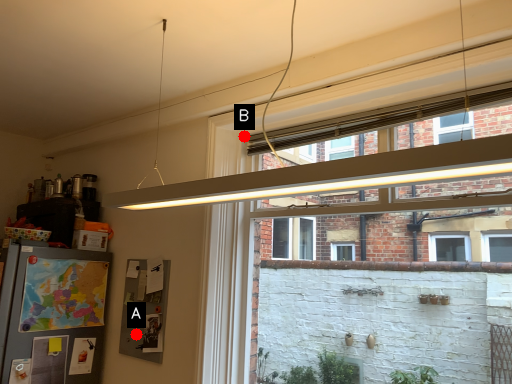
Question: Two points are circled on the image, labeled by A and B beside each circle. Which point appears closest to the camera in this image?

Choices:
 (A) A is closer
 (B) B is closer

Answer: (B)